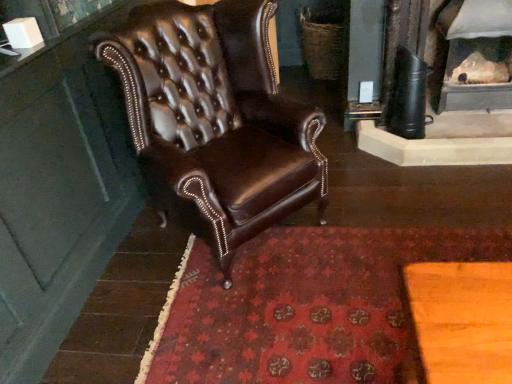
Image resolution: width=512 pixels, height=384 pixels. I want to click on empty space that is ontop of red carpet at center (from a real-world perspective), so click(x=306, y=294).